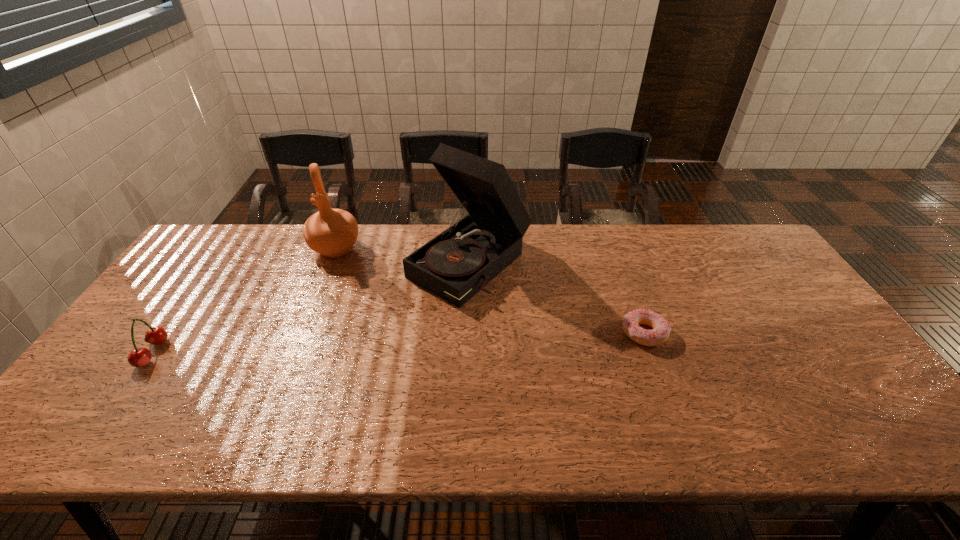
The image size is (960, 540). I want to click on the third tallest object, so click(x=139, y=357).

The height and width of the screenshot is (540, 960). I want to click on cherry, so click(139, 357).

Locate an element on the screen. This screenshot has height=540, width=960. the rightmost object is located at coordinates (661, 328).

Locate an element on the screen. This screenshot has width=960, height=540. doughnut is located at coordinates (661, 328).

At what (x,y) coordinates should I click in order to perform the action: click on phonograph_record. Please return your answer as a coordinate pair (x, y). This screenshot has width=960, height=540. Looking at the image, I should click on (455, 265).

Locate an element on the screen. This screenshot has height=540, width=960. the third object from left to right is located at coordinates (455, 265).

At what (x,y) coordinates should I click in order to perform the action: click on the third object from right to left. Please return your answer as a coordinate pair (x, y). The width and height of the screenshot is (960, 540). Looking at the image, I should click on (331, 232).

Locate an element on the screen. Image resolution: width=960 pixels, height=540 pixels. the third shortest object is located at coordinates (331, 232).

Identify the location of vacant space located with stems pointing upwards on the leftmost object. (115, 353).

Where is `free spot located 0.300m on the back of the shortest object`? This screenshot has height=540, width=960. free spot located 0.300m on the back of the shortest object is located at coordinates (614, 252).